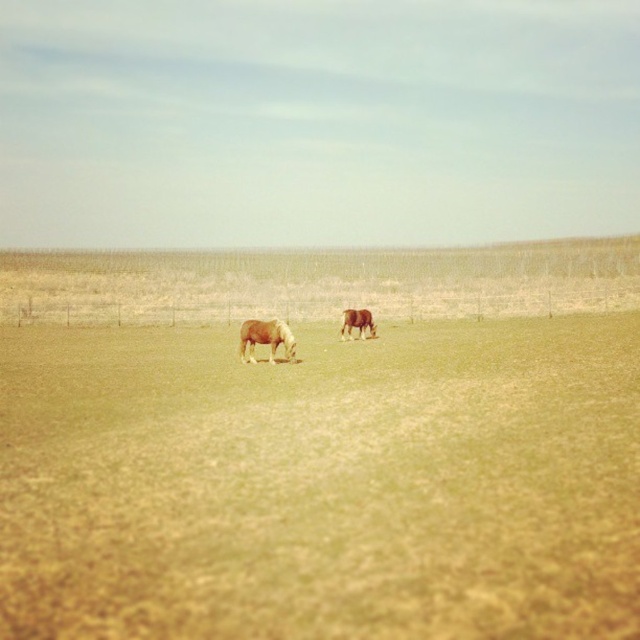
You are a photographer trying to capture the brown matte horse at center in your shot. However, the green grassy field at center is blocking your view. Can you adjust your angle to see the horse without moving it?

The green grassy field at center is positioned under the brown matte horse at center, so adjusting your angle downward might allow you to see the horse above the grass.